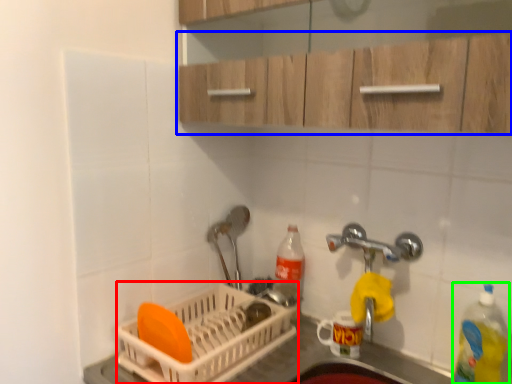
Question: Estimate the real-world distances between objects in this image. Which object is farther from basket (highlighted by a red box), cabinetry (highlighted by a blue box) or bottle (highlighted by a green box)?

Choices:
 (A) cabinetry
 (B) bottle

Answer: (A)